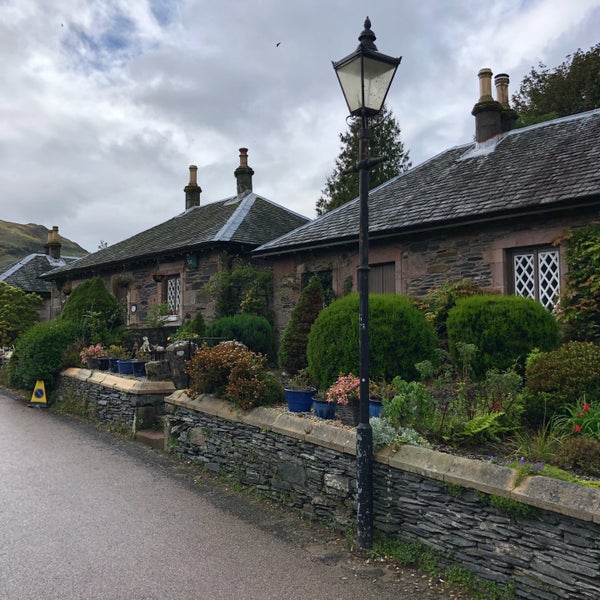
Find the location of a particular element. The width and height of the screenshot is (600, 600). glass is located at coordinates (356, 80).